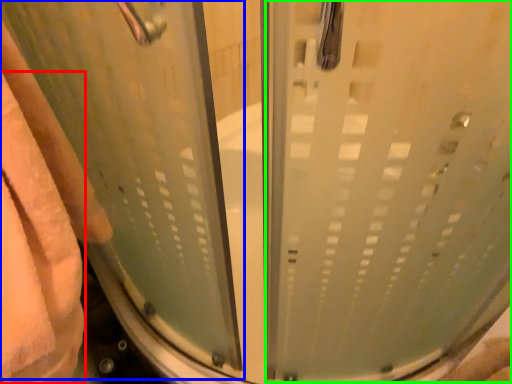
Question: Which object is the closest to the bath towel (highlighted by a red box)? Choose among these: screen door (highlighted by a blue box) or screen door (highlighted by a green box).

Choices:
 (A) screen door
 (B) screen door

Answer: (A)